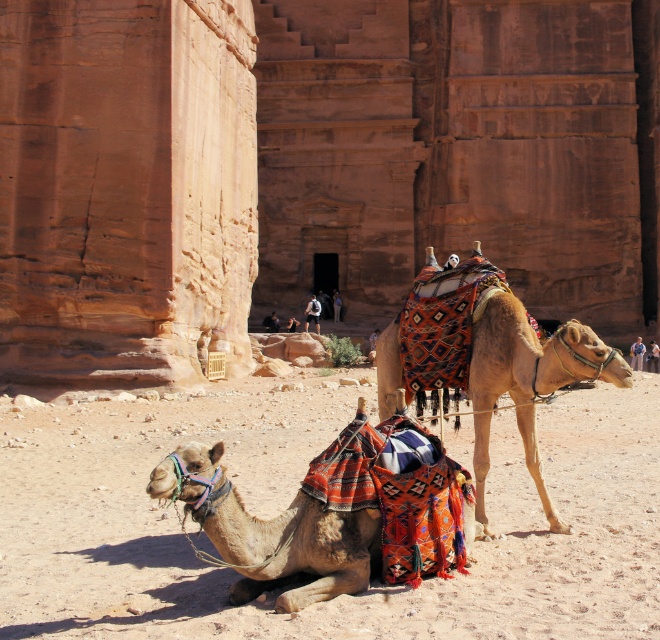
You are a photographer standing in the desert scene. You want to take a photo of the sandy beige sand at lower center and the multicolored woven saddle at center. Which object should you focus on first if you want to capture both in sharp focus?

The sandy beige sand at lower center is closer to the viewer than the multicolored woven saddle at center. To capture both in sharp focus, you should focus on the multicolored woven saddle at center first, as it is farther away, ensuring the depth of field includes both objects.

In the scene shown: You are standing in the desert scene and want to walk from the sandy beige sand at lower center to the multicolored fabric camel at lower left. Which direction should you move?

You should move to the right because the sandy beige sand at lower center is to the left of the multicolored fabric camel at lower left.

You are a traveler in the desert and need to cross the area where the sandy beige sand at lower center and the multicolored fabric camel at lower left are located. Can you walk directly between them without stepping on the camel?

The sandy beige sand at lower center is positioned under the multicolored fabric camel at lower left, so you can walk directly between them without stepping on the camel.